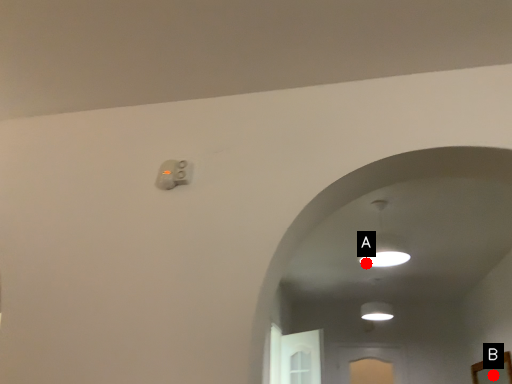
Question: Two points are circled on the image, labeled by A and B beside each circle. Which point is closer to the camera taking this photo?

Choices:
 (A) A is closer
 (B) B is closer

Answer: (A)